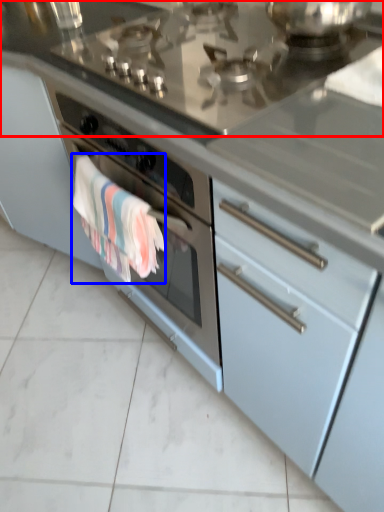
Question: Which of the following is the closest to the observer, countertop (highlighted by a red box) or bath towel (highlighted by a blue box)?

Choices:
 (A) countertop
 (B) bath towel

Answer: (A)